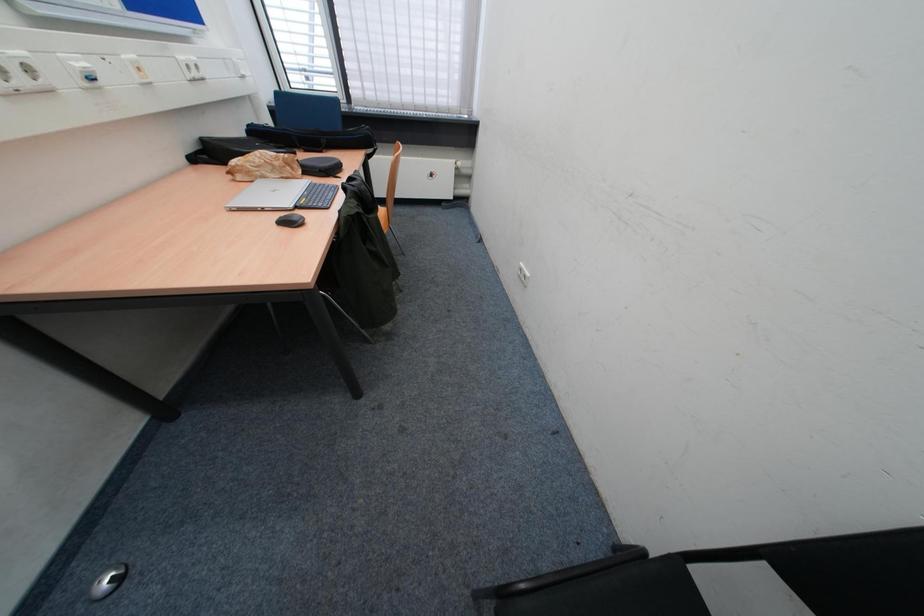
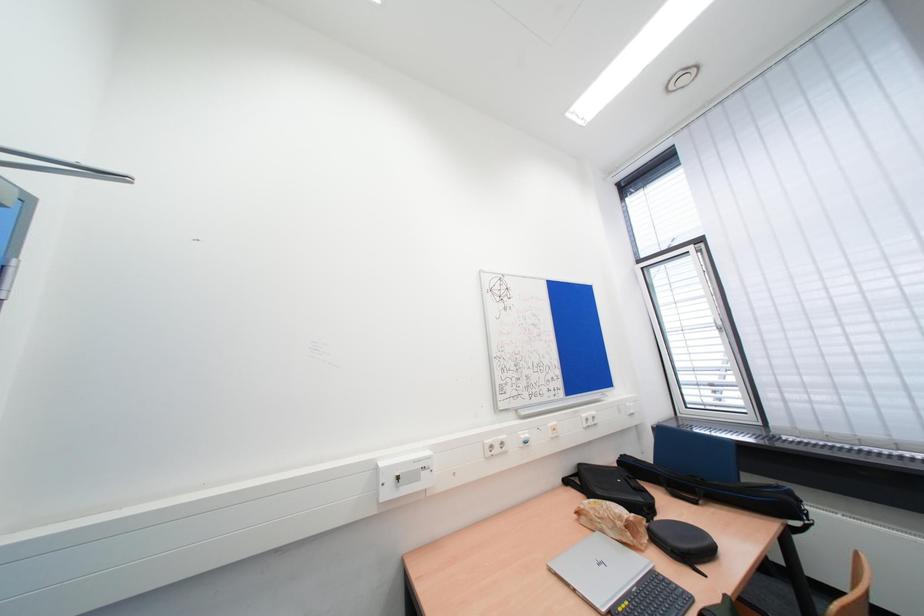
How did the camera likely rotate?

The camera's rotation is toward left-up.